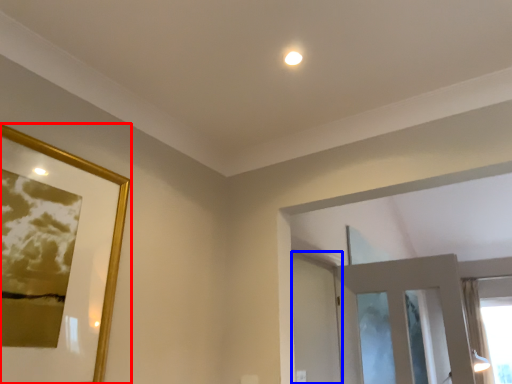
Question: Among these objects, which one is nearest to the camera, picture frame (highlighted by a red box) or screen door (highlighted by a blue box)?

Choices:
 (A) picture frame
 (B) screen door

Answer: (A)